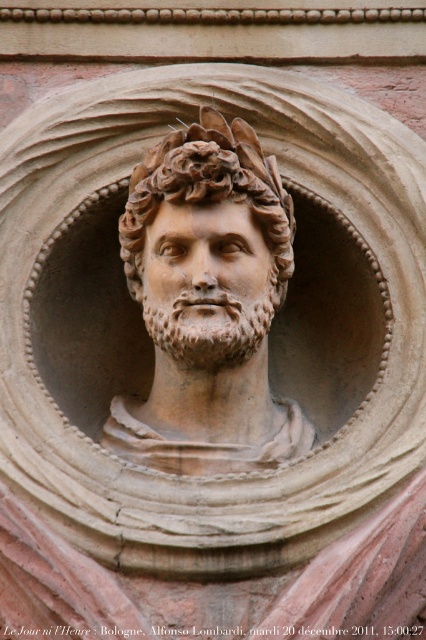
Does matte stone bust at center have a lesser height compared to rough stone face at center?

In fact, matte stone bust at center may be taller than rough stone face at center.

Which is behind, point (230, 141) or point (233, 273)?

The point (230, 141) is behind.

Identify the location of matte stone bust at center. Image resolution: width=426 pixels, height=640 pixels. (207, 304).

Identify the location of matte stone bust at center. (207, 304).